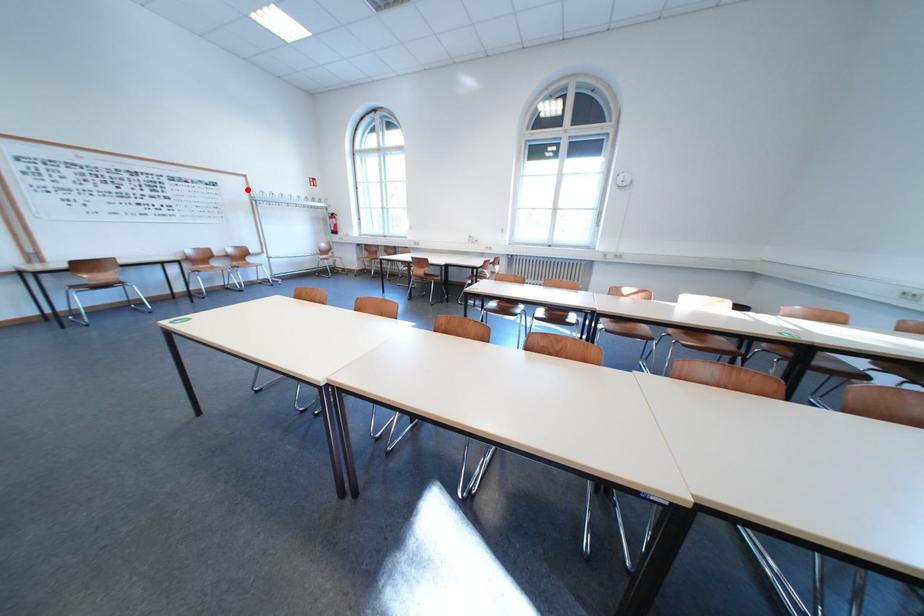
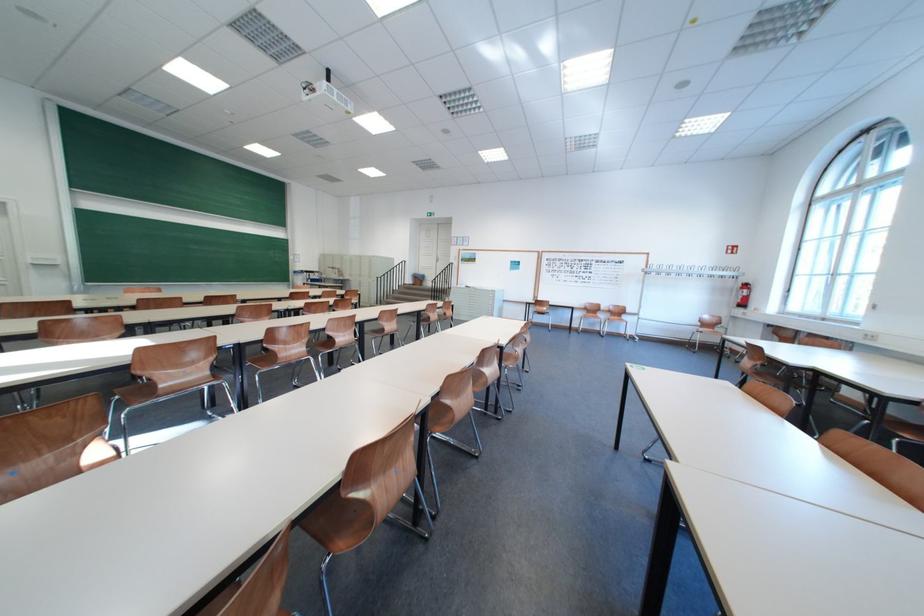
Question: I am providing you with two images of the same scene from different viewpoints. A red point is shown in image1. For the corresponding object point in image2, is it positioned nearer or farther from the camera?

Choices:
 (A) Nearer
 (B) Farther

Answer: (B)